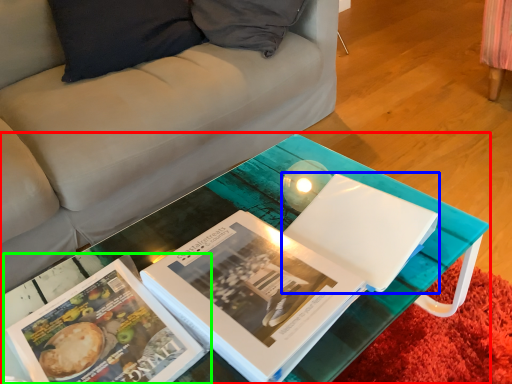
Question: Which object is positioned farthest from table (highlighted by a red box)? Select from paperback book (highlighted by a blue box) and book (highlighted by a green box).

Choices:
 (A) paperback book
 (B) book

Answer: (B)